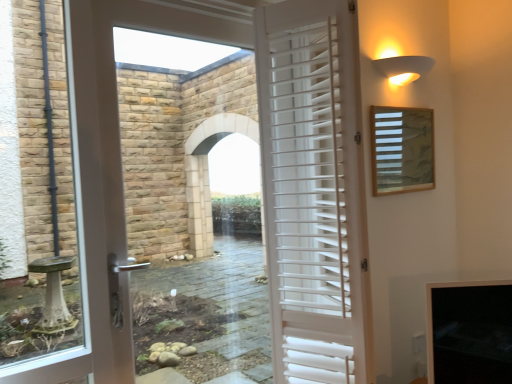
Question: Visually, is wooden slats at upper right positioned to the left or to the right of white matte wall sconce at upper right?

Choices:
 (A) left
 (B) right

Answer: (A)

Question: From a real-world perspective, is wooden slats at upper right physically located above or below white matte wall sconce at upper right?

Choices:
 (A) below
 (B) above

Answer: (A)

Question: Estimate the real-world distances between objects in this image. Which object is farther from the white wooden shutters at center?

Choices:
 (A) wooden slats at upper right
 (B) white matte wall sconce at upper right

Answer: (B)

Question: Which is farther from the white wooden shutters at center?

Choices:
 (A) wooden slats at upper right
 (B) white matte wall sconce at upper right

Answer: (B)